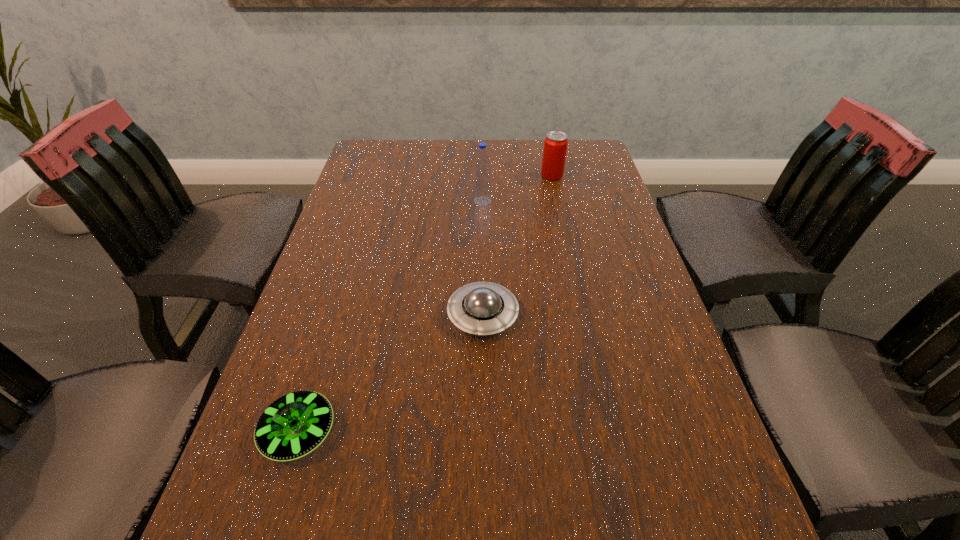
The height and width of the screenshot is (540, 960). Identify the location of vacant space at the far right corner of the desktop. (584, 144).

Where is `free space between the third shortest object and the third farthest object`? The height and width of the screenshot is (540, 960). free space between the third shortest object and the third farthest object is located at coordinates (517, 245).

Where is `vacant space that is in between the farthest object and the left saucer`? vacant space that is in between the farthest object and the left saucer is located at coordinates pyautogui.click(x=426, y=304).

This screenshot has height=540, width=960. Find the location of `empty location between the second farthest object and the right saucer`. empty location between the second farthest object and the right saucer is located at coordinates (483, 258).

In order to click on free space that is in between the can and the nearer saucer in this screenshot , I will do `click(426, 304)`.

Locate an element on the screen. The height and width of the screenshot is (540, 960). vacant space in between the tallest object and the nearest object is located at coordinates (391, 317).

Where is `vacant area that lies between the left saucer and the second tallest object`? vacant area that lies between the left saucer and the second tallest object is located at coordinates (426, 304).

You are a GUI agent. You are given a task and a screenshot of the screen. Output one action in this format:
    pyautogui.click(x=<x>, y=<y>)
    Task: Click on the free point between the third shortest object and the second farthest object
    The width and height of the screenshot is (960, 540).
    Given the screenshot: What is the action you would take?
    pyautogui.click(x=517, y=188)

Image resolution: width=960 pixels, height=540 pixels. Find the location of `empty space that is in between the water bottle and the can`. empty space that is in between the water bottle and the can is located at coordinates (517, 188).

Where is `free point between the third farthest object and the leftmost object`? This screenshot has height=540, width=960. free point between the third farthest object and the leftmost object is located at coordinates (392, 374).